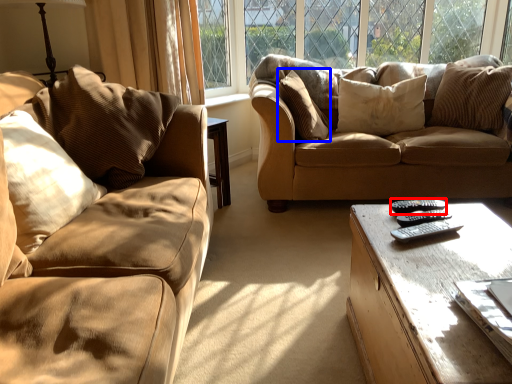
Question: Which point is further to the camera, remote (highlighted by a red box) or pillow (highlighted by a blue box)?

Choices:
 (A) remote
 (B) pillow

Answer: (B)